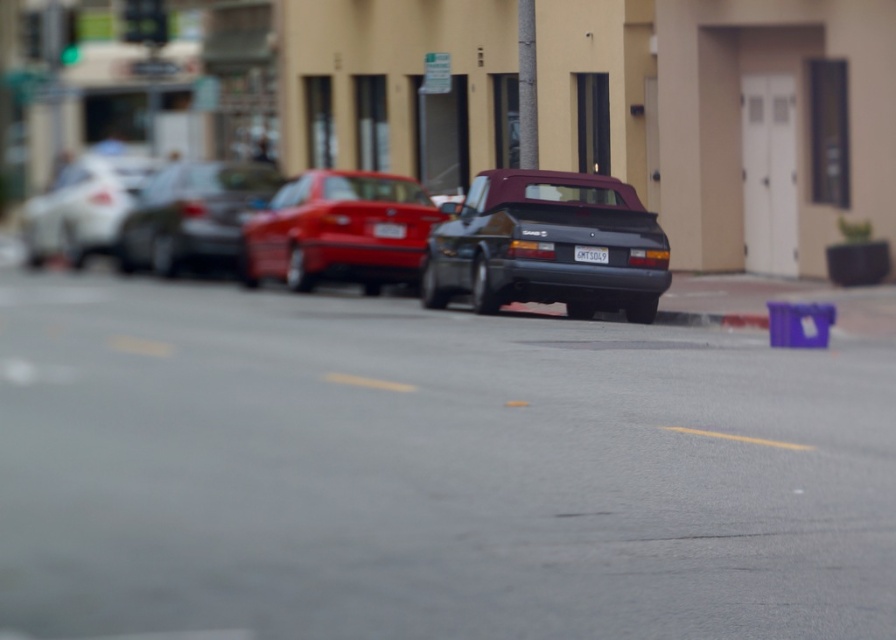
You are a delivery driver who needs to park your 5.5 meter long truck between the shiny silver sedan at center and the white glossy sedan at left. Can you fit your truck in the space between them?

The shiny silver sedan at center is shorter than the white glossy sedan at left, but the distance between them isn not specified. Without knowing the exact space between the two sedans, it is impossible to determine if the 5.5 meter truck can fit.

You are a delivery driver who needs to park your 1.8 meters wide van between the shiny silver sedan at center and the white glossy sedan at left. Can you fit your van in the space between them?

The shiny silver sedan at center has a lesser width compared to white glossy sedan at left, so the space between them may vary depending on their positioning. However, since the shiny silver sedan is narrower, the gap between them might be sufficient for your 1.8 meters wide van, but it is recommended to measure the space first to ensure it accommodates the vehicle.

You are a delivery driver who needs to park your vehicle in this parking area. Your vehicle is 4.5 meters long. You see the white glossy sedan at left and the white plastic license plate at center. Is there enough space between them to park your vehicle?

The distance between the white glossy sedan at left and the white plastic license plate at center is 15.69 meters, which is more than enough space to park a vehicle that is 4.5 meters long.